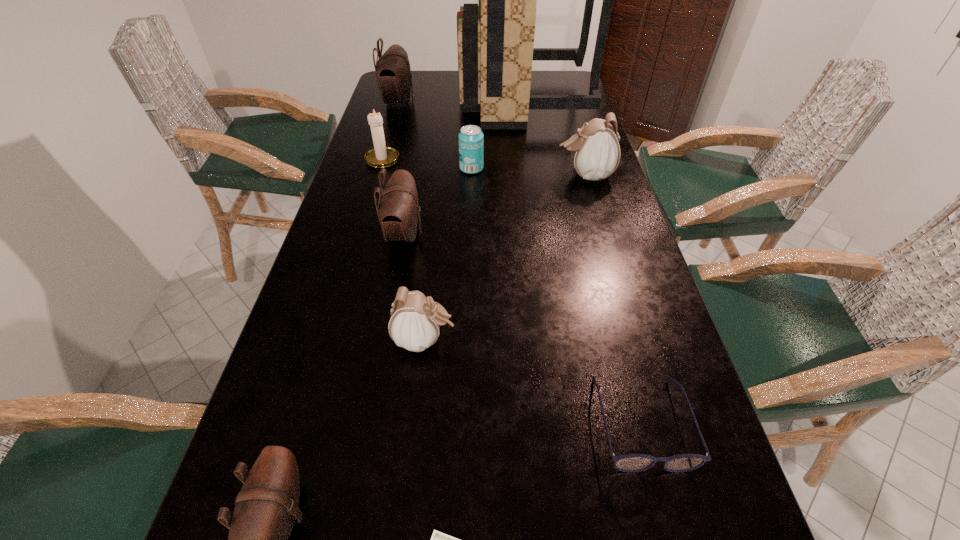
Locate an element on the screen. the fourth closest object relative to the white candle holder is located at coordinates (398, 209).

Point out which object is positioned as the sixth nearest to the ninth tallest object. Please provide its 2D coordinates. Your answer should be formatted as a tuple, i.e. [(x, y)], where the tuple contains the x and y coordinates of a point satisfying the conditions above.

[(470, 139)]

Where is `pouch that stands as the third closest to the spectacles`? pouch that stands as the third closest to the spectacles is located at coordinates (398, 209).

The image size is (960, 540). Identify the location of the closest pouch to the nearest pouch. (415, 320).

Identify which brown pouch is the closest to the left white pouch. Please provide its 2D coordinates. Your answer should be formatted as a tuple, i.e. [(x, y)], where the tuple contains the x and y coordinates of a point satisfying the conditions above.

[(398, 209)]

Choose which brown pouch is the nearest neighbor to the beer can. Please provide its 2D coordinates. Your answer should be formatted as a tuple, i.e. [(x, y)], where the tuple contains the x and y coordinates of a point satisfying the conditions above.

[(398, 209)]

You are a GUI agent. You are given a task and a screenshot of the screen. Output one action in this format:
    pyautogui.click(x=<x>, y=<y>)
    Task: Click on the free space that satisfies the following two spatial constraints: 1. on the front side of the beer can; 2. on the front-facing side of the smaller white pouch
    Image resolution: width=960 pixels, height=540 pixels.
    Given the screenshot: What is the action you would take?
    pyautogui.click(x=468, y=340)

I want to click on free location that satisfies the following two spatial constraints: 1. with the flap open on the farthest brown pouch; 2. on the handle side of the candle holder, so click(383, 158).

Identify the location of vacant space that satisfies the following two spatial constraints: 1. on the handle side of the candle holder; 2. with the flap open on the farthest pouch. The width and height of the screenshot is (960, 540). (398, 103).